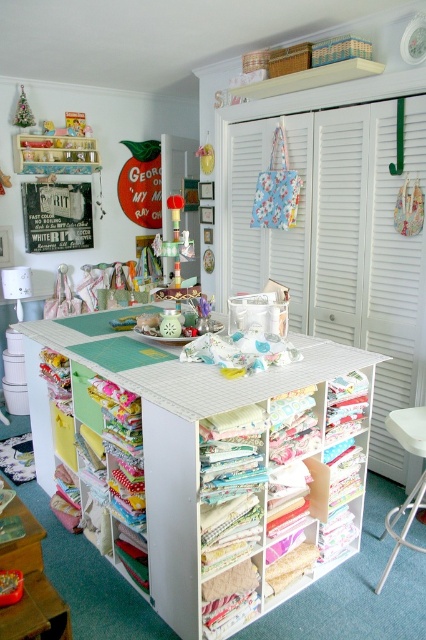
You are a guest in the craft room and need to place a small item on the tallest object in the room. Which object should you choose between the white plastic stool at lower right and the translucent plastic toy at center?

The white plastic stool at lower right is taller than the translucent plastic toy at center, so you should place the item on the white plastic stool at lower right.